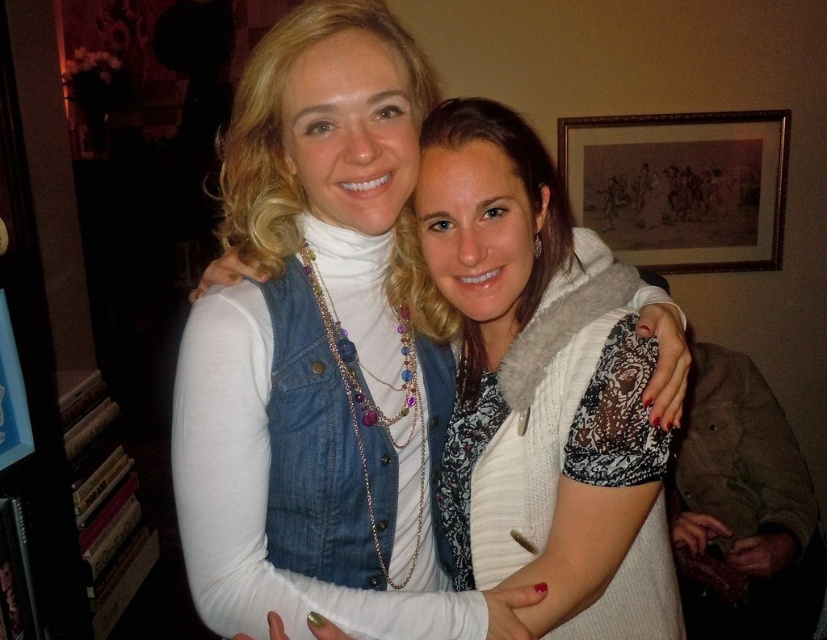
What are the coordinates of `denim vest at center` in the screenshot? It's located at (318, 353).

Measure the distance from denim vest at center to wooden framed artwork at upper right.

They are 6.77 feet apart.

This screenshot has width=827, height=640. Find the location of `denim vest at center`. denim vest at center is located at coordinates (318, 353).

Where is `denim vest at center`? The height and width of the screenshot is (640, 827). denim vest at center is located at coordinates (318, 353).